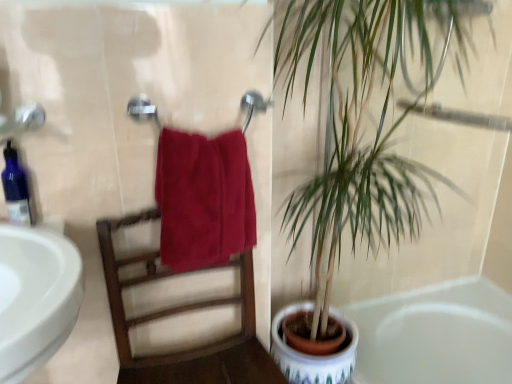
Question: From a real-world perspective, relative to wooden chair at center, is matte metal towel bar at center vertically above or below?

Choices:
 (A) above
 (B) below

Answer: (A)

Question: From the image's perspective, is matte metal towel bar at center above or below wooden chair at center?

Choices:
 (A) above
 (B) below

Answer: (A)

Question: Which of these objects is positioned closest to the wooden chair at center?

Choices:
 (A) blue glass soap dispenser at left
 (B) white glossy bathtub at lower right
 (C) satin red towel at center
 (D) matte metal towel bar at center
 (E) green leafy plant at right

Answer: (C)

Question: Which is farther from the blue glass soap dispenser at left?

Choices:
 (A) wooden chair at center
 (B) green leafy plant at right
 (C) white glossy bathtub at lower right
 (D) satin red towel at center
 (E) matte metal towel bar at center

Answer: (C)